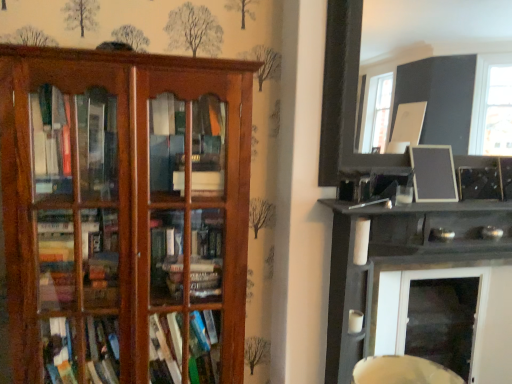
Question: Can you confirm if black matte picture frame at upper right, which appears as the second picture frame when viewed from the top, is smaller than black glossy shelf at upper right, which appears as the second shelf when viewed from the left?

Choices:
 (A) yes
 (B) no

Answer: (A)

Question: Is black matte picture frame at upper right, which appears as the second picture frame when viewed from the top, directly adjacent to black glossy shelf at upper right, which appears as the second shelf when viewed from the left?

Choices:
 (A) yes
 (B) no

Answer: (B)

Question: Is black glossy shelf at upper right, positioned as the 1th shelf in right-to-left order, a part of black matte picture frame at upper right, which appears as the second picture frame when viewed from the top?

Choices:
 (A) no
 (B) yes

Answer: (A)

Question: From the image's perspective, is black matte picture frame at upper right, the first picture frame ordered from the bottom, on top of black glossy shelf at upper right, which appears as the second shelf when viewed from the left?

Choices:
 (A) yes
 (B) no

Answer: (A)

Question: From the image's perspective, is black matte picture frame at upper right, which appears as the second picture frame when viewed from the top, below black glossy shelf at upper right, which appears as the second shelf when viewed from the left?

Choices:
 (A) yes
 (B) no

Answer: (B)

Question: Can you confirm if black matte picture frame at upper right, the first picture frame ordered from the bottom, is shorter than black glossy shelf at upper right, positioned as the 1th shelf in right-to-left order?

Choices:
 (A) yes
 (B) no

Answer: (A)

Question: Is matte black picture frame at upper right, acting as the 2th picture frame starting from the bottom, wider than wooden bookshelf at left, the 2th shelf when ordered from right to left?

Choices:
 (A) no
 (B) yes

Answer: (A)

Question: Is matte black picture frame at upper right, the 1th picture frame viewed from the top, aimed at wooden bookshelf at left, which is the 1th shelf in left-to-right order?

Choices:
 (A) no
 (B) yes

Answer: (A)

Question: From a real-world perspective, is matte black picture frame at upper right, acting as the 2th picture frame starting from the bottom, under wooden bookshelf at left, which is the 1th shelf in left-to-right order?

Choices:
 (A) yes
 (B) no

Answer: (B)

Question: Can we say matte black picture frame at upper right, the 1th picture frame viewed from the top, lies outside wooden bookshelf at left, the 2th shelf when ordered from right to left?

Choices:
 (A) no
 (B) yes

Answer: (B)

Question: Is matte black picture frame at upper right, the 1th picture frame viewed from the top, taller than wooden bookshelf at left, which is the 1th shelf in left-to-right order?

Choices:
 (A) yes
 (B) no

Answer: (B)

Question: Does matte black picture frame at upper right, acting as the 2th picture frame starting from the bottom, have a larger size compared to wooden bookshelf at left, the 2th shelf when ordered from right to left?

Choices:
 (A) no
 (B) yes

Answer: (A)

Question: Is black glossy shelf at upper right, which appears as the second shelf when viewed from the left, smaller than black matte picture frame at upper right, the first picture frame ordered from the bottom?

Choices:
 (A) no
 (B) yes

Answer: (A)